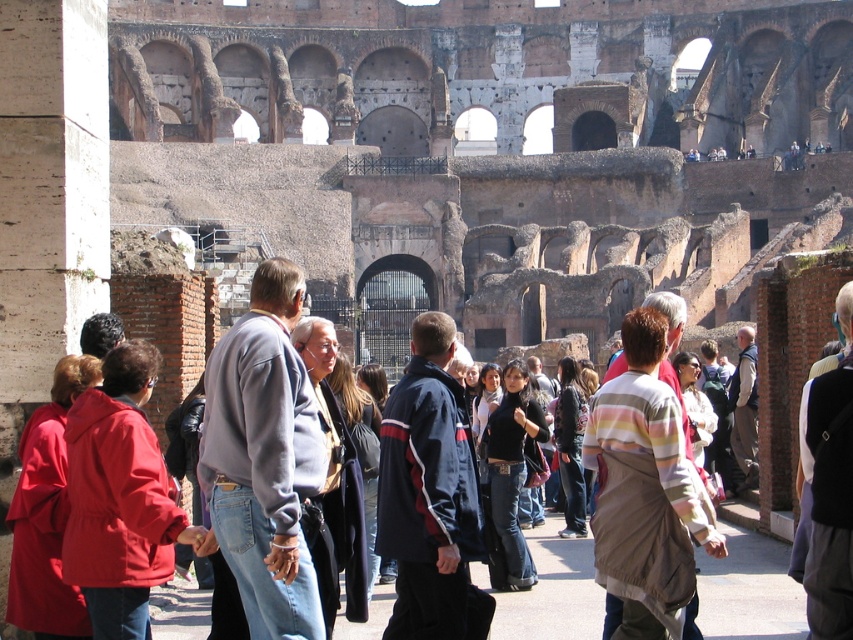
You are a tour guide standing at the Colosseum. You notice two tourists wearing a matte red coat at lower left and a white cotton shirt at center. Which tourist is closer to the base of the Colosseum?

The matte red coat at lower left is closer to the base of the Colosseum because it is located below the white cotton shirt at center, indicating a lower position in the scene.

You are a photographer standing at the Colosseum and want to take a picture of the dark gray sweater at center. Where should you aim your camera to capture it?

You should aim your camera at the point with coordinates (334, 484) to capture the dark gray sweater at center.

You are a photographer standing at the Colosseum and want to capture a photo of the dark gray sweater at center without the matte red coat at lower left appearing in the foreground. Is this possible given their positions?

The matte red coat at lower left is positioned under the dark gray sweater at center, so it would block the view of the sweater. Therefore, it is not possible to capture the dark gray sweater at center without the matte red coat at lower left appearing in the foreground.